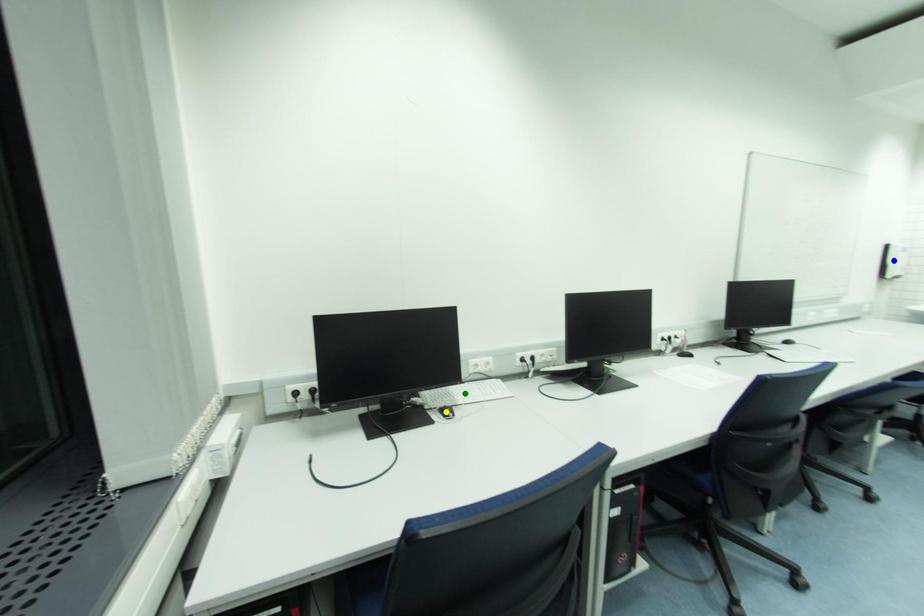
Order these from nearest to farthest:
- yellow point
- blue point
- green point

1. yellow point
2. green point
3. blue point